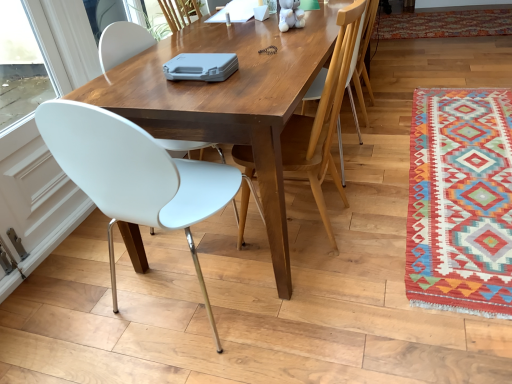
What is the approximate height of wooden chair at upper right, the 3th chair in the left-to-right sequence?

It is 28.79 inches.

The width and height of the screenshot is (512, 384). What do you see at coordinates (323, 118) in the screenshot?
I see `white plastic chair at center, placed as the 2th chair when sorted from right to left` at bounding box center [323, 118].

This screenshot has width=512, height=384. Identify the location of multicolored woven rug at lower right, which appears as the second mat when viewed from the back. (460, 201).

Is wooden table at center to the right of wooden chair at upper right, marked as the first chair in a right-to-left arrangement, from the viewer's perspective?

No.

From a real-world perspective, which is physically above, wooden table at center or wooden chair at upper right, marked as the first chair in a right-to-left arrangement?

wooden table at center.

From the image's perspective, between wooden table at center and wooden chair at upper right, the 3th chair in the left-to-right sequence, which one is located above?

From the image's view, wooden chair at upper right, the 3th chair in the left-to-right sequence, is above.

Considering the positions of point (208, 123) and point (361, 28), is point (208, 123) closer or farther from the camera than point (361, 28)?

Point (208, 123) is positioned closer to the camera compared to point (361, 28).

Looking at this image, which object is positioned more to the left, white plastic chair at left, the first chair when ordered from left to right, or white plastic chair at center, placed as the 2th chair when sorted from right to left?

Positioned to the left is white plastic chair at left, the first chair when ordered from left to right.

Is white plastic chair at left, which is the 3th chair in right-to-left order, next to white plastic chair at center, placed as the second chair when sorted from left to right?

They are not placed beside each other.

Is white plastic chair at left, which is the 3th chair in right-to-left order, oriented away from white plastic chair at center, placed as the second chair when sorted from left to right?

white plastic chair at left, which is the 3th chair in right-to-left order, is not turned away from white plastic chair at center, placed as the second chair when sorted from left to right.

In order to click on mat in front of the multicolored woven rug at right, placed as the 2th mat when sorted from bottom to top in this screenshot , I will do `click(460, 201)`.

From a real-world perspective, who is located higher, multicolored woven rug at right, placed as the 2th mat when sorted from bottom to top, or multicolored woven rug at lower right, positioned as the 1th mat in bottom-to-top order?

From a 3D spatial view, multicolored woven rug at right, placed as the 2th mat when sorted from bottom to top, is above.

Which object is positioned more to the left, multicolored woven rug at right, acting as the 1th mat starting from the back, or multicolored woven rug at lower right, which appears as the second mat when viewed from the back?

multicolored woven rug at lower right, which appears as the second mat when viewed from the back.

Which object is thinner, multicolored woven rug at right, the 2th mat viewed from the front, or multicolored woven rug at lower right, positioned as the 1th mat in bottom-to-top order?

Thinner between the two is multicolored woven rug at lower right, positioned as the 1th mat in bottom-to-top order.

Considering the positions of point (239, 75) and point (483, 255), is point (239, 75) closer or farther from the camera than point (483, 255)?

Point (239, 75).

Is wooden table at center directly adjacent to multicolored woven rug at lower right, which is counted as the 1th mat, starting from the front?

No, wooden table at center is not beside multicolored woven rug at lower right, which is counted as the 1th mat, starting from the front.

The width and height of the screenshot is (512, 384). I want to click on mat that is the 1st one when counting backward from the wooden table at center, so click(460, 201).

Considering the sizes of objects white plastic chair at left, which is the 3th chair in right-to-left order, and wooden table at center in the image provided, who is wider, white plastic chair at left, which is the 3th chair in right-to-left order, or wooden table at center?

Wider between the two is wooden table at center.

Is white plastic chair at left, the first chair when ordered from left to right, positioned beyond the bounds of wooden table at center?

That's incorrect, white plastic chair at left, the first chair when ordered from left to right, is not completely outside wooden table at center.

How different are the orientations of white plastic chair at left, which is the 3th chair in right-to-left order, and wooden table at center in degrees?

There is a 90.7-degree angle between the facing directions of white plastic chair at left, which is the 3th chair in right-to-left order, and wooden table at center.

Is white plastic chair at left, which is the 3th chair in right-to-left order, turned away from multicolored woven rug at right, the 2th mat viewed from the front?

white plastic chair at left, which is the 3th chair in right-to-left order, is not turned away from multicolored woven rug at right, the 2th mat viewed from the front.

Find the location of `mat that is the 1st object directly below the white plastic chair at left, the first chair when ordered from left to right (from a real-world perspective)`. mat that is the 1st object directly below the white plastic chair at left, the first chair when ordered from left to right (from a real-world perspective) is located at coordinates (444, 24).

Based on the photo, from their relative heights in the image, would you say white plastic chair at left, which is the 3th chair in right-to-left order, is taller or shorter than multicolored woven rug at right, placed as the 2th mat when sorted from bottom to top?

white plastic chair at left, which is the 3th chair in right-to-left order, is taller than multicolored woven rug at right, placed as the 2th mat when sorted from bottom to top.

Considering the relative sizes of white plastic chair at left, the first chair when ordered from left to right, and multicolored woven rug at right, acting as the 1th mat starting from the back, in the image provided, is white plastic chair at left, the first chair when ordered from left to right, smaller than multicolored woven rug at right, acting as the 1th mat starting from the back,?

Actually, white plastic chair at left, the first chair when ordered from left to right, might be larger than multicolored woven rug at right, acting as the 1th mat starting from the back.

Identify the location of mat that is the 2nd one below the wooden table at center (from a real-world perspective). (460, 201).

Which is correct: multicolored woven rug at lower right, positioned as the 1th mat in bottom-to-top order, is inside wooden table at center, or outside of it?

multicolored woven rug at lower right, positioned as the 1th mat in bottom-to-top order, is not inside wooden table at center, it's outside.

From a real-world perspective, which is physically above, multicolored woven rug at lower right, which appears as the second mat when viewed from the back, or wooden table at center?

In real-world perspective, wooden table at center is above.

I want to click on kitchen & dining room table that is in front of the wooden chair at upper right, marked as the first chair in a right-to-left arrangement, so click(228, 100).

Starting from the white plastic chair at left, the first chair when ordered from left to right, which chair is the 1st one behind? Please provide its 2D coordinates.

[(323, 118)]

Looking at the image, which one is located further to white plastic chair at left, the first chair when ordered from left to right, white plastic chair at center, placed as the 2th chair when sorted from right to left, or wooden table at center?

The object further to white plastic chair at left, the first chair when ordered from left to right, is white plastic chair at center, placed as the 2th chair when sorted from right to left.

From the picture: Which object lies further to the anchor point wooden chair at upper right, marked as the first chair in a right-to-left arrangement, wooden table at center or white plastic chair at center, placed as the second chair when sorted from left to right?

wooden table at center lies further to wooden chair at upper right, marked as the first chair in a right-to-left arrangement, than the other object.

Consider the image. Which object lies nearer to the anchor point wooden table at center, multicolored woven rug at right, the 2th mat viewed from the front, or white plastic chair at center, placed as the second chair when sorted from left to right?

white plastic chair at center, placed as the second chair when sorted from left to right, is closer to wooden table at center.

Considering their positions, is multicolored woven rug at right, acting as the 1th mat starting from the back, positioned closer to wooden chair at upper right, marked as the first chair in a right-to-left arrangement, than multicolored woven rug at lower right, which appears as the second mat when viewed from the back?

The object closer to wooden chair at upper right, marked as the first chair in a right-to-left arrangement, is multicolored woven rug at lower right, which appears as the second mat when viewed from the back.

From the image, which object appears to be nearer to white plastic chair at left, which is the 3th chair in right-to-left order, multicolored woven rug at lower right, which appears as the second mat when viewed from the back, or multicolored woven rug at right, the 2th mat viewed from the front?

Based on the image, multicolored woven rug at lower right, which appears as the second mat when viewed from the back, appears to be nearer to white plastic chair at left, which is the 3th chair in right-to-left order.

Looking at the image, which one is located further to wooden chair at upper right, the 3th chair in the left-to-right sequence, white plastic chair at left, the first chair when ordered from left to right, or multicolored woven rug at lower right, which appears as the second mat when viewed from the back?

Among the two, white plastic chair at left, the first chair when ordered from left to right, is located further to wooden chair at upper right, the 3th chair in the left-to-right sequence.

Based on their spatial positions, is white plastic chair at center, placed as the second chair when sorted from left to right, or wooden chair at upper right, the 3th chair in the left-to-right sequence, closer to multicolored woven rug at lower right, which is counted as the 1th mat, starting from the front?

white plastic chair at center, placed as the second chair when sorted from left to right, lies closer to multicolored woven rug at lower right, which is counted as the 1th mat, starting from the front, than the other object.

When comparing their distances from white plastic chair at center, placed as the second chair when sorted from left to right, does multicolored woven rug at right, the first mat viewed from the top, or white plastic chair at left, the first chair when ordered from left to right, seem closer?

white plastic chair at left, the first chair when ordered from left to right, is closer to white plastic chair at center, placed as the second chair when sorted from left to right.

Find the location of `mat between wooden table at center and wooden chair at upper right, the 3th chair in the left-to-right sequence, in the front-back direction`. mat between wooden table at center and wooden chair at upper right, the 3th chair in the left-to-right sequence, in the front-back direction is located at coordinates (460, 201).

What are the coordinates of `chair that lies between wooden table at center and white plastic chair at left, the first chair when ordered from left to right, from top to bottom` in the screenshot? It's located at (323, 118).

I want to click on mat between wooden table at center and multicolored woven rug at right, the first mat viewed from the top, in the front-back direction, so click(460, 201).

In order to click on chair between wooden table at center and wooden chair at upper right, the 3th chair in the left-to-right sequence, from front to back in this screenshot , I will do `click(323, 118)`.